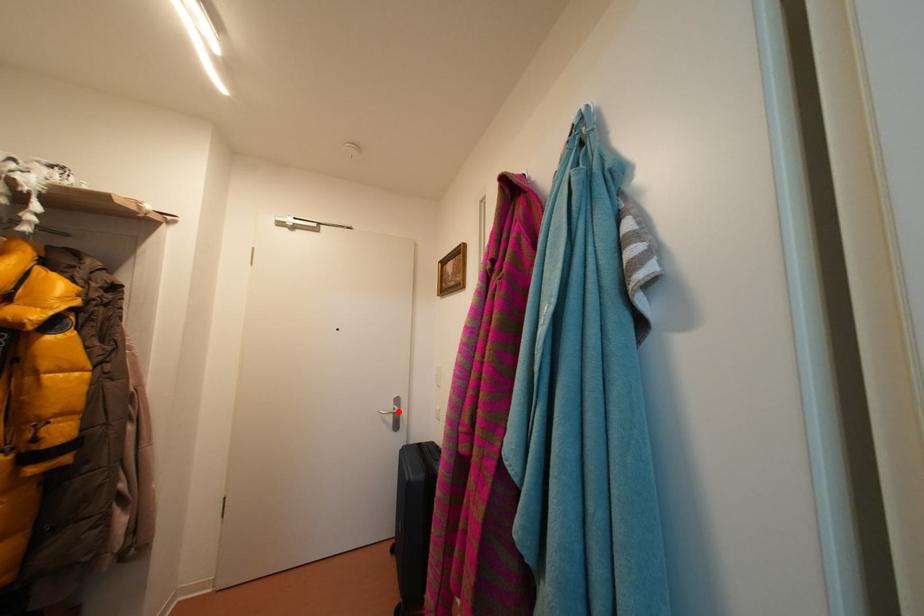
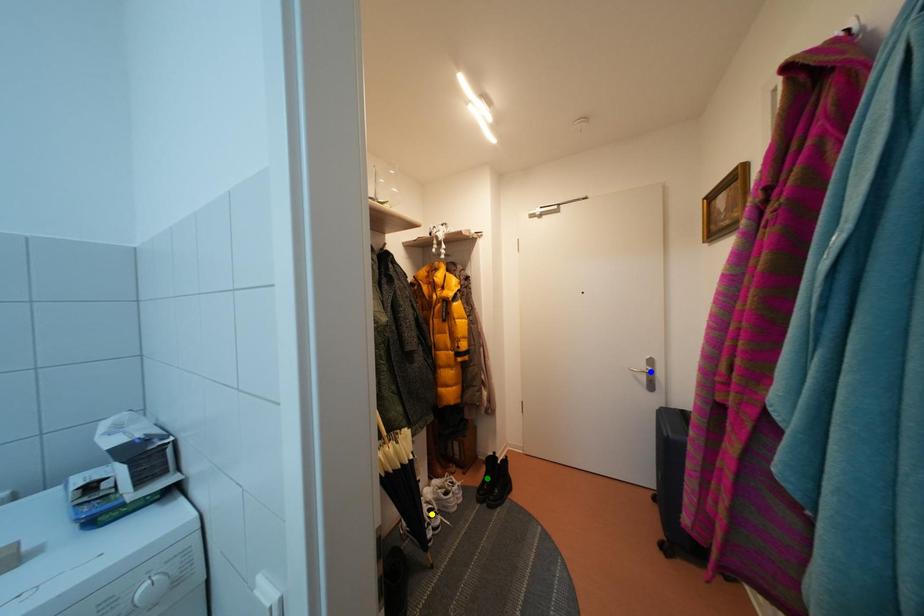
Question: I am providing you with two images of the same scene from different viewpoints. A red point is marked on the first image. You are given multiple points on the second image. Which point in image 2 is actually the same real-world point as the red point in image 1?

Choices:
 (A) blue point
 (B) yellow point
 (C) green point

Answer: (A)